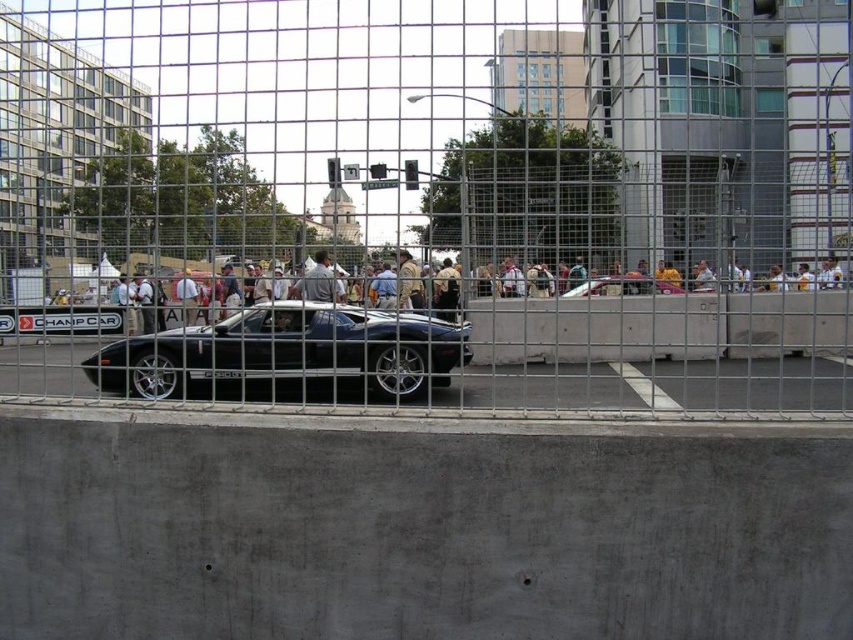
You are standing behind a metal grid fence looking at a sports car and a person wearing a jacket. The shiny silver sports car at center and the light gray fabric jacket at center are both in your view. Which object is positioned to the right side?

The shiny silver sports car at center is to the right of the light gray fabric jacket at center.

You are a photographer standing behind the metal grid fence. You want to take a photo of the shiny black sports car at center without the concrete at center appearing in the shot. Can you move closer to the car to achieve this? The camera you are using has a maximum zoom of 10x.

The shiny black sports car at center and concrete at center are 6.42 meters apart. Since you are behind the metal grid fence and the concrete is between you and the car, you cannot move closer than the concrete. Therefore, the concrete will always be in the frame unless you can zoom in enough to exclude it. With a 10x zoom, it depends on your current distance, but the question doesn not provide enough information about your starting position to determine feasibility.

You are a photographer trying to capture both the shiny silver sports car at center and the light gray fabric jacket at center in a single photo. Based on their sizes in the image, which object should you focus on first to ensure both are in frame?

The shiny silver sports car at center is bigger than the light gray fabric jacket at center, so you should focus on the shiny silver sports car at center first to ensure it fits in the frame, then adjust to include the smaller jacket.